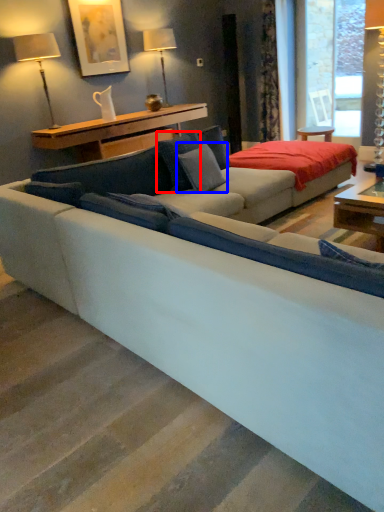
Question: Which of the following is the farthest to the observer, pillow (highlighted by a red box) or pillow (highlighted by a blue box)?

Choices:
 (A) pillow
 (B) pillow

Answer: (A)